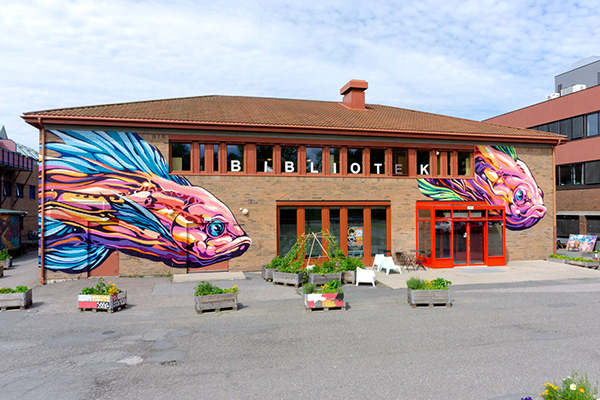
Locate an element on the screen. Image resolution: width=600 pixels, height=400 pixels. green plant is located at coordinates (287, 264), (212, 290), (93, 291), (411, 280), (320, 290).